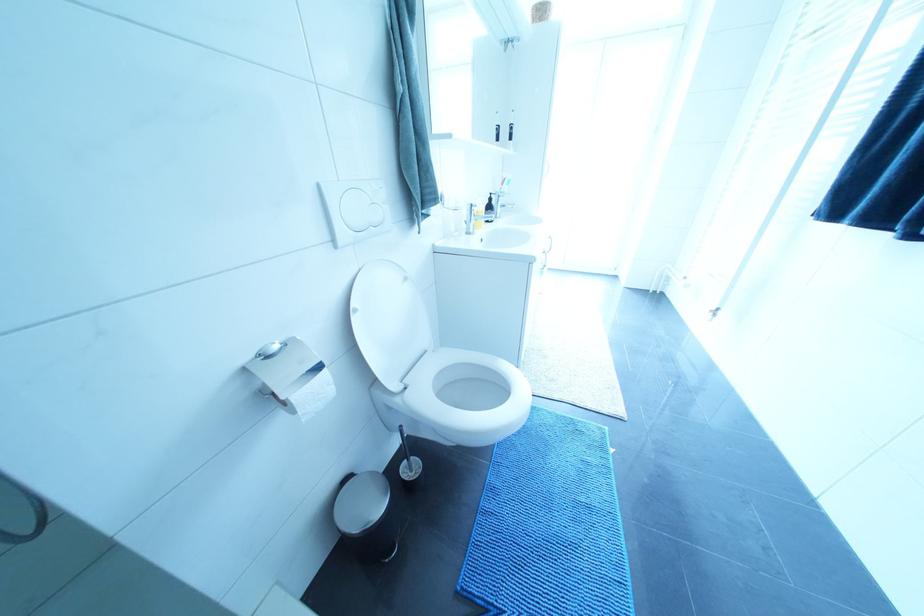
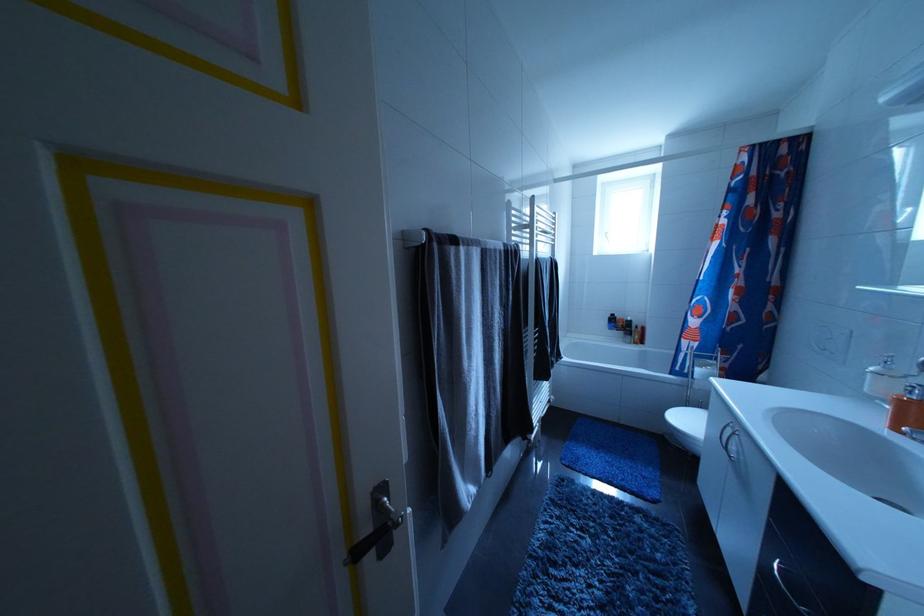
Question: What movement of the cameraman would produce the second image?

Choices:
 (A) Left
 (B) Right
 (C) Forward
 (D) Backward

Answer: (A)